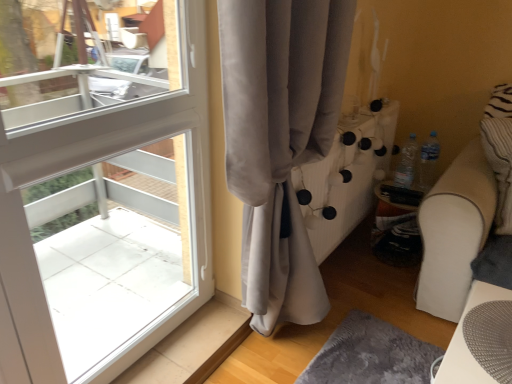
Question: Is point (456, 342) positioned closer to the camera than point (323, 132)?

Choices:
 (A) closer
 (B) farther

Answer: (A)

Question: Considering the positions of white mesh table at lower right and satin gray curtain at left in the image, is white mesh table at lower right wider or thinner than satin gray curtain at left?

Choices:
 (A) wide
 (B) thin

Answer: (A)

Question: From the image's perspective, is white mesh table at lower right located above or below satin gray curtain at left?

Choices:
 (A) below
 (B) above

Answer: (A)

Question: In the image, is satin gray curtain at left positioned in front of or behind white mesh table at lower right?

Choices:
 (A) behind
 (B) front

Answer: (B)

Question: In terms of size, does satin gray curtain at left appear bigger or smaller than white mesh table at lower right?

Choices:
 (A) big
 (B) small

Answer: (A)

Question: Is point (327, 43) closer or farther from the camera than point (453, 339)?

Choices:
 (A) farther
 (B) closer

Answer: (A)

Question: In terms of width, does satin gray curtain at left look wider or thinner when compared to white mesh table at lower right?

Choices:
 (A) wide
 (B) thin

Answer: (B)